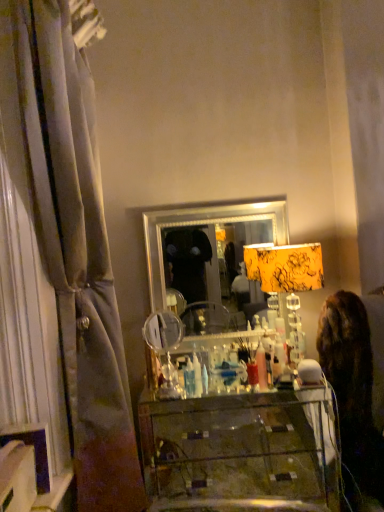
Find the location of a particular element. This screenshot has height=512, width=384. free space above silver/metallic mirror at center (from a real-world perspective) is located at coordinates tap(209, 206).